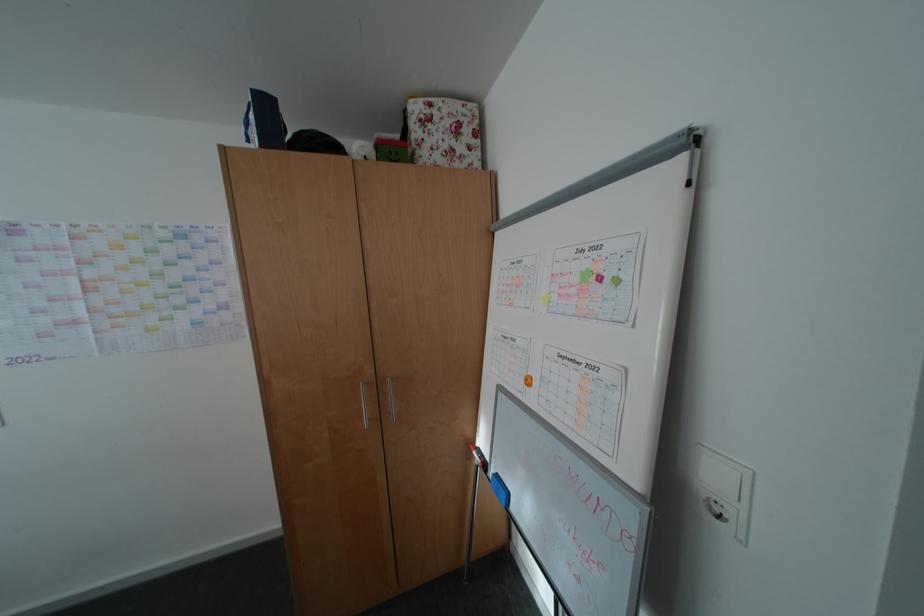
Find where to lift the pink sticky note. Please return your answer as a coordinate pair (x, y).

(535, 381)